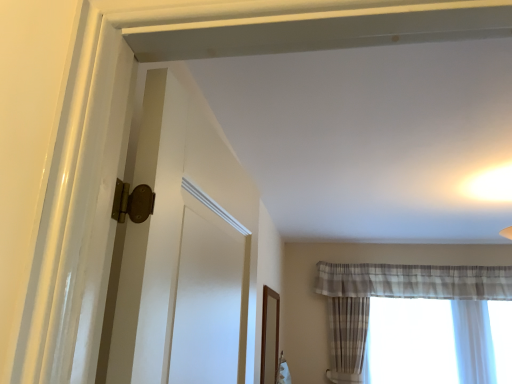
I want to click on plaid fabric curtain at right, so click(x=428, y=342).

This screenshot has height=384, width=512. What do you see at coordinates (428, 342) in the screenshot? I see `plaid fabric curtain at right` at bounding box center [428, 342].

What are the coordinates of `plaid sheer curtain at right` in the screenshot? It's located at (411, 297).

This screenshot has width=512, height=384. Describe the element at coordinates (411, 297) in the screenshot. I see `plaid sheer curtain at right` at that location.

This screenshot has height=384, width=512. Find the location of `plaid fabric curtain at right`. plaid fabric curtain at right is located at coordinates (428, 342).

Which object is positioned more to the left, plaid sheer curtain at right or plaid fabric curtain at right?

Positioned to the left is plaid sheer curtain at right.

Who is more distant, plaid sheer curtain at right or plaid fabric curtain at right?

plaid fabric curtain at right is further from the camera.

Which point is more forward, [409,267] or [474,375]?

The point [474,375] is more forward.

From the image's perspective, is plaid sheer curtain at right located above or below plaid fabric curtain at right?

plaid sheer curtain at right is above plaid fabric curtain at right.

From a real-world perspective, is plaid sheer curtain at right positioned above or below plaid fabric curtain at right?

From a real-world perspective, plaid sheer curtain at right is physically above plaid fabric curtain at right.

In the scene shown: Which of these two, plaid sheer curtain at right or plaid fabric curtain at right, is thinner?

With smaller width is plaid sheer curtain at right.

Does plaid sheer curtain at right have a greater height compared to plaid fabric curtain at right?

Yes, plaid sheer curtain at right is taller than plaid fabric curtain at right.

Can you confirm if plaid sheer curtain at right is smaller than plaid fabric curtain at right?

Incorrect, plaid sheer curtain at right is not smaller in size than plaid fabric curtain at right.

Would you say plaid fabric curtain at right is part of plaid sheer curtain at right's contents?

No, plaid fabric curtain at right is not inside plaid sheer curtain at right.

Does plaid sheer curtain at right touch plaid fabric curtain at right?

No, plaid sheer curtain at right is not with plaid fabric curtain at right.

Consider the image. Is plaid sheer curtain at right oriented away from plaid fabric curtain at right?

Yes, plaid sheer curtain at right is positioned with its back facing plaid fabric curtain at right.

In the image, there is a plaid sheer curtain at right. Identify the location of window below it (from a real-world perspective). (428, 342).

Which object is positioned more to the right, plaid fabric curtain at right or plaid sheer curtain at right?

plaid fabric curtain at right.

Is plaid fabric curtain at right closer to camera compared to plaid sheer curtain at right?

No, the depth of plaid fabric curtain at right is greater than that of plaid sheer curtain at right.

Does point (374, 342) come farther from viewer compared to point (366, 277)?

No, (374, 342) is in front of (366, 277).

From the image's perspective, is plaid fabric curtain at right beneath plaid sheer curtain at right?

Yes, from the image's perspective, plaid fabric curtain at right is below plaid sheer curtain at right.

From a real-world perspective, is plaid fabric curtain at right on top of plaid sheer curtain at right?

No, from a real-world perspective, plaid fabric curtain at right is not above plaid sheer curtain at right.

Considering the relative sizes of plaid fabric curtain at right and plaid sheer curtain at right in the image provided, is plaid fabric curtain at right thinner than plaid sheer curtain at right?

In fact, plaid fabric curtain at right might be wider than plaid sheer curtain at right.

Can you confirm if plaid fabric curtain at right is shorter than plaid sheer curtain at right?

Indeed, plaid fabric curtain at right has a lesser height compared to plaid sheer curtain at right.

Considering the sizes of objects plaid fabric curtain at right and plaid sheer curtain at right in the image provided, who is bigger, plaid fabric curtain at right or plaid sheer curtain at right?

plaid sheer curtain at right.

Is plaid fabric curtain at right not inside plaid sheer curtain at right?

Yes, plaid fabric curtain at right is located beyond the bounds of plaid sheer curtain at right.

Is the surface of plaid fabric curtain at right in direct contact with plaid sheer curtain at right?

No, plaid fabric curtain at right is not making contact with plaid sheer curtain at right.

Is plaid fabric curtain at right oriented away from plaid sheer curtain at right?

Correct, plaid fabric curtain at right is looking away from plaid sheer curtain at right.

Can you tell me how much plaid fabric curtain at right and plaid sheer curtain at right differ in facing direction?

plaid fabric curtain at right and plaid sheer curtain at right are facing 0.736 degrees away from each other.

Find the location of `window behind the plaid sheer curtain at right`. window behind the plaid sheer curtain at right is located at coordinates (428, 342).

Find the location of a particular element. This screenshot has width=512, height=384. window below the plaid sheer curtain at right (from a real-world perspective) is located at coordinates (428, 342).

The width and height of the screenshot is (512, 384). I want to click on curtain in front of the plaid fabric curtain at right, so click(411, 297).